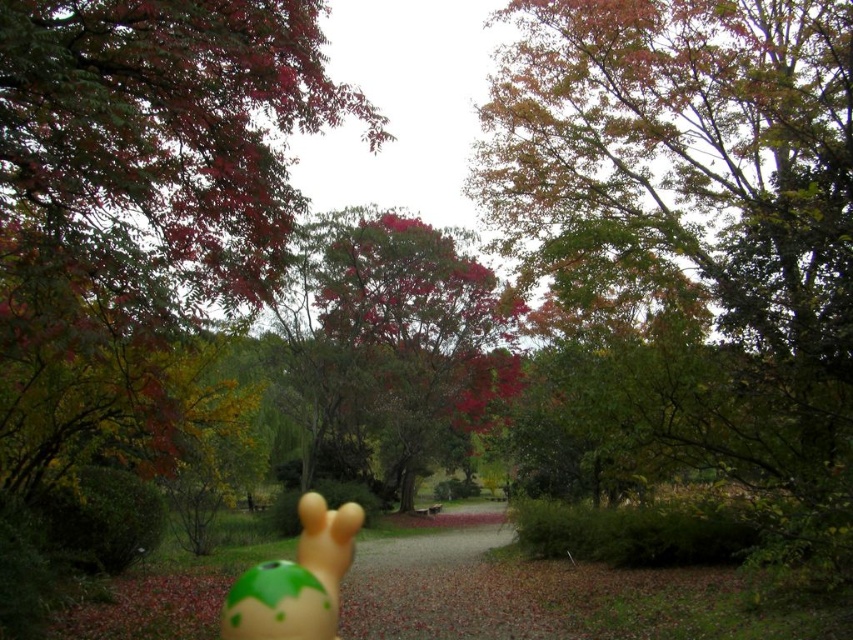
Question: Does green leafy tree at upper center have a lesser width compared to reddish-brown bark tree at center?

Choices:
 (A) no
 (B) yes

Answer: (B)

Question: Estimate the real-world distances between objects in this image. Which object is farther from the reddish-brown bark tree at center?

Choices:
 (A) matte green rubber toy at center
 (B) green leafy tree at upper center

Answer: (B)

Question: Which point appears farthest from the camera in this image?

Choices:
 (A) (451, 353)
 (B) (300, 506)
 (C) (215, 275)
 (D) (814, 400)

Answer: (A)

Question: Among these points, which one is farthest from the camera?

Choices:
 (A) (221, 257)
 (B) (668, 417)
 (C) (242, 573)

Answer: (C)

Question: Is green leafy tree at upper center above smooth red leaves at upper left?

Choices:
 (A) yes
 (B) no

Answer: (A)

Question: Is smooth red leaves at upper left positioned behind reddish-brown bark tree at center?

Choices:
 (A) yes
 (B) no

Answer: (B)